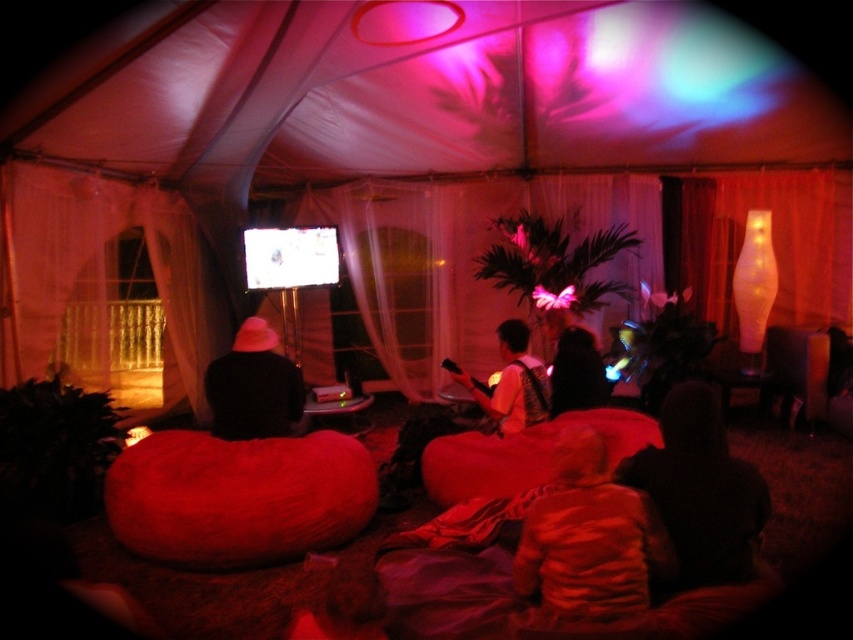
Question: Which point appears closest to the camera in this image?

Choices:
 (A) (560, 413)
 (B) (338, 113)
 (C) (544, 381)
 (D) (701, 516)

Answer: (D)

Question: Is dark fabric jacket at lower right positioned behind pink fabric bean bag at center?

Choices:
 (A) yes
 (B) no

Answer: (B)

Question: Which of the following is the closest to the observer?

Choices:
 (A) (230, 396)
 (B) (544, 384)
 (C) (201, 440)
 (D) (263, 118)

Answer: (C)

Question: Can you confirm if velvet-like brown coat at lower center is positioned to the right of white fabric shirt at center?

Choices:
 (A) yes
 (B) no

Answer: (A)

Question: Observing the image, what is the correct spatial positioning of velvet-like red bean bag at lower left in reference to velvet red beanbag at center?

Choices:
 (A) below
 (B) above

Answer: (A)

Question: Among these objects, which one is farthest from the camera?

Choices:
 (A) white fabric shirt at center
 (B) dark fabric jacket at lower right

Answer: (A)